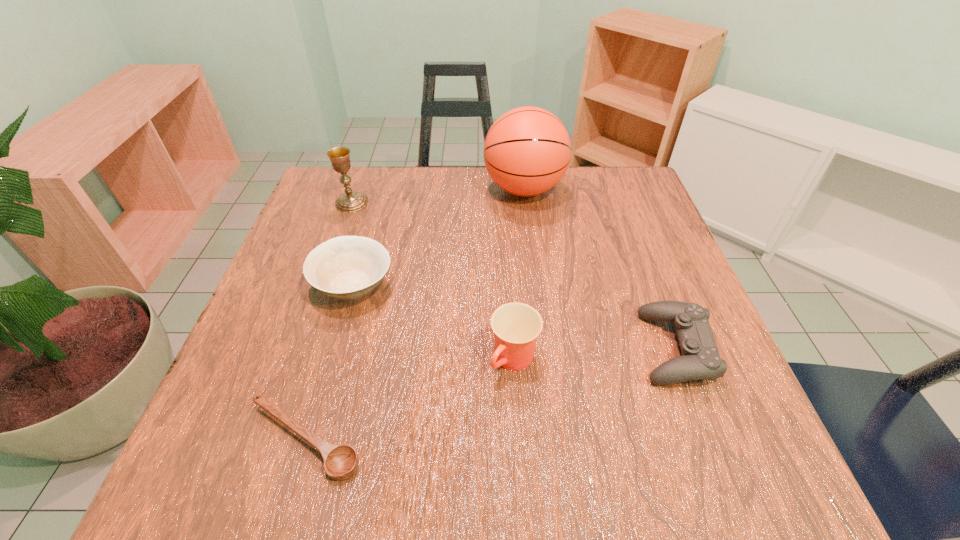
Find the location of a particular element. This screenshot has height=540, width=960. the tallest object is located at coordinates (527, 151).

Find the location of a particular element. The width and height of the screenshot is (960, 540). the fifth shortest object is located at coordinates (350, 202).

Where is `cup`? The width and height of the screenshot is (960, 540). cup is located at coordinates (516, 326).

You are a GUI agent. You are given a task and a screenshot of the screen. Output one action in this format:
    pyautogui.click(x=<x>, y=<y>)
    Task: Click on the bowl
    
    Given the screenshot: What is the action you would take?
    pyautogui.click(x=346, y=267)

Identify the location of the fifth tallest object. tap(700, 360).

At what (x,y) coordinates should I click in order to perform the action: click on the rightmost object. Please return your answer as a coordinate pair (x, y). Looking at the image, I should click on (700, 360).

The width and height of the screenshot is (960, 540). Identify the location of the shortest object. (341, 462).

The width and height of the screenshot is (960, 540). Find the location of `the nearest object`. the nearest object is located at coordinates (341, 462).

At what (x,y) coordinates should I click in order to perform the action: click on blank space located on the front of the tallest object. Please return your answer as a coordinate pair (x, y). Image resolution: width=960 pixels, height=540 pixels. Looking at the image, I should click on (531, 243).

Where is `free space located on the front of the chalice`? free space located on the front of the chalice is located at coordinates (338, 242).